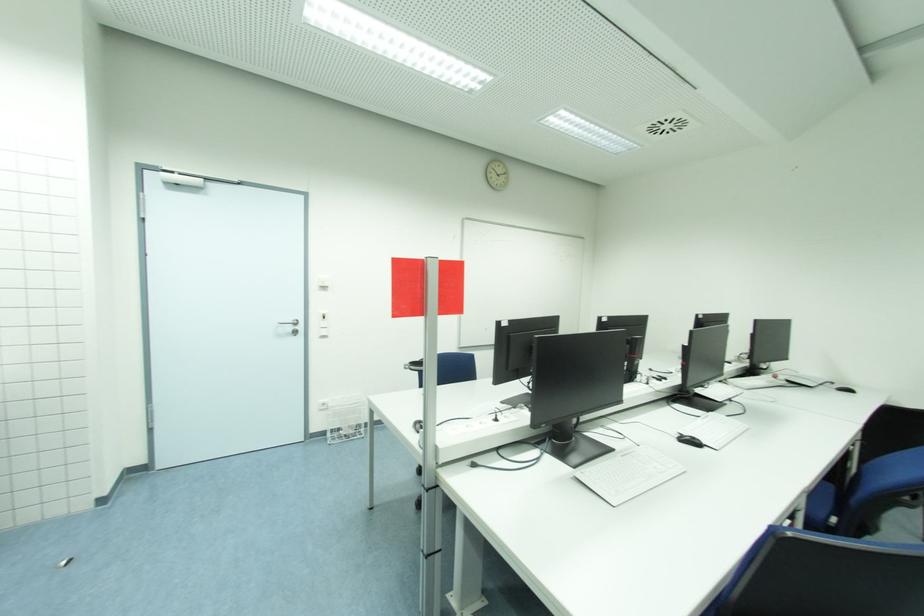
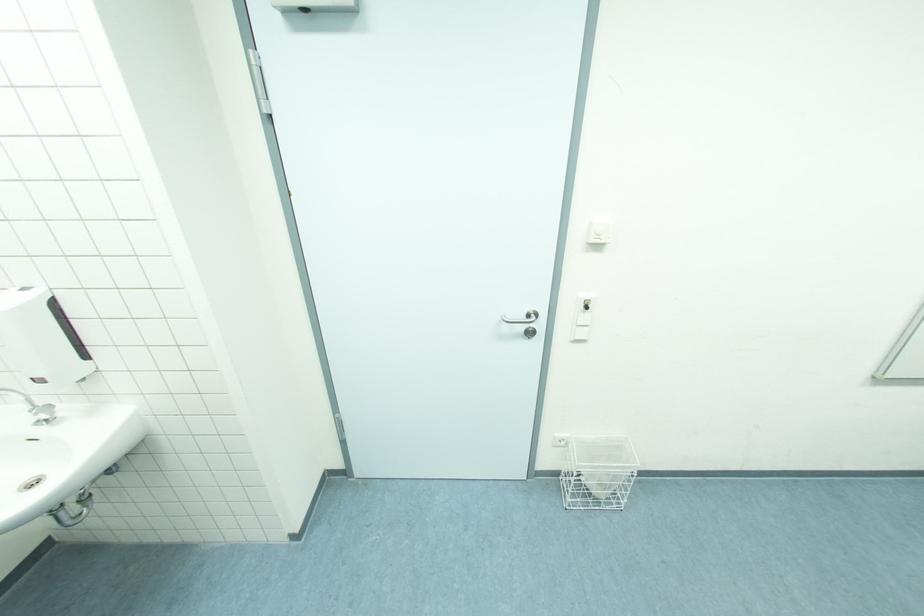
Locate, in the second image, the point that corresponds to (x=327, y=325) in the first image.

(589, 318)